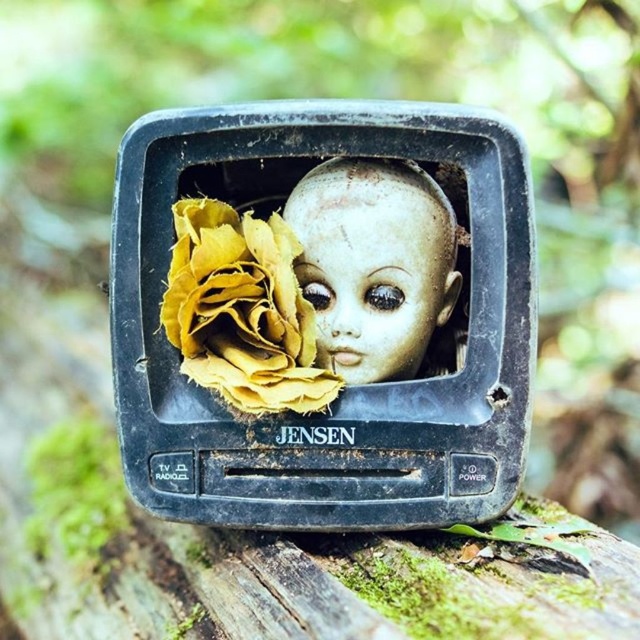
You are standing in front of the vintage Jensen television set on the mossy log. You see two points marked on the TV screen. Which point is closer to you, point (246, 380) or point (358, 336)?

Point (246, 380) is in front of point (358, 336), so it is closer to you.

You are an artist looking for materials. You see a vintage Jensen television set outdoors with a yellow crumpled paper at center and a pale porcelain face at center inside it. Which object is taller?

The yellow crumpled paper at center is taller than the pale porcelain face at center.